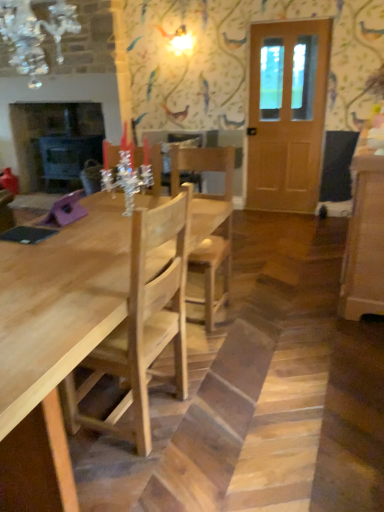
Question: Considering the relative sizes of light wood table at center and wooden door at right in the image provided, is light wood table at center thinner than wooden door at right?

Choices:
 (A) yes
 (B) no

Answer: (B)

Question: Is light wood table at center placed right next to wooden door at right?

Choices:
 (A) no
 (B) yes

Answer: (A)

Question: Considering the relative positions of light wood table at center and wooden door at right in the image provided, is light wood table at center behind wooden door at right?

Choices:
 (A) no
 (B) yes

Answer: (A)

Question: Is light wood table at center at the left side of wooden door at right?

Choices:
 (A) no
 (B) yes

Answer: (B)

Question: Could you tell me if light wood table at center is turned towards wooden door at right?

Choices:
 (A) yes
 (B) no

Answer: (B)

Question: From the image's perspective, relative to wooden door at right, is light wood table at center above or below?

Choices:
 (A) below
 (B) above

Answer: (A)

Question: Considering the positions of point (29, 327) and point (281, 179), is point (29, 327) closer or farther from the camera than point (281, 179)?

Choices:
 (A) closer
 (B) farther

Answer: (A)

Question: Is light wood table at center inside or outside of wooden door at right?

Choices:
 (A) outside
 (B) inside

Answer: (A)

Question: Considering their positions, is light wood table at center located in front of or behind wooden door at right?

Choices:
 (A) behind
 (B) front

Answer: (B)

Question: Considering their positions, is matte black fireplace at left located in front of or behind wooden door at right?

Choices:
 (A) front
 (B) behind

Answer: (B)

Question: Does point (67, 110) appear closer or farther from the camera than point (294, 126)?

Choices:
 (A) farther
 (B) closer

Answer: (A)

Question: Is matte black fireplace at left wider or thinner than wooden door at right?

Choices:
 (A) thin
 (B) wide

Answer: (B)

Question: Would you say matte black fireplace at left is inside or outside wooden door at right?

Choices:
 (A) inside
 (B) outside

Answer: (B)

Question: Looking at their shapes, would you say wooden door at right is wider or thinner than natural wood chair at center?

Choices:
 (A) thin
 (B) wide

Answer: (A)

Question: Considering the positions of wooden door at right and natural wood chair at center in the image, is wooden door at right bigger or smaller than natural wood chair at center?

Choices:
 (A) big
 (B) small

Answer: (B)